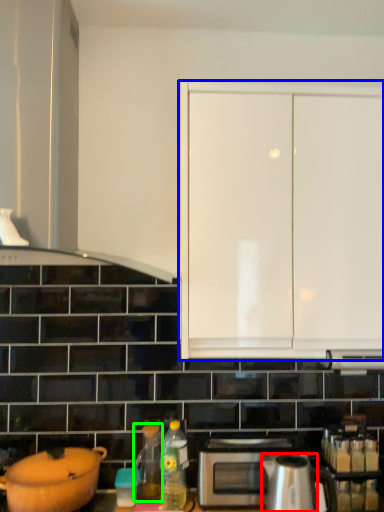
Question: Considering the real-world distances, which object is closest to kitchen appliance (highlighted by a red box)? cabinetry (highlighted by a blue box) or tea pot (highlighted by a green box).

Choices:
 (A) cabinetry
 (B) tea pot

Answer: (B)